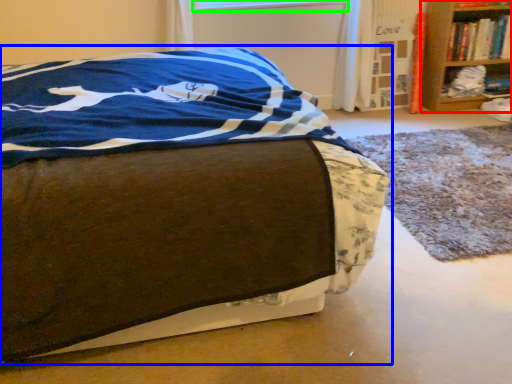
Question: Which is farther away from shelf (highlighted by a red box)? bed (highlighted by a blue box) or window screen (highlighted by a green box)?

Choices:
 (A) bed
 (B) window screen

Answer: (A)